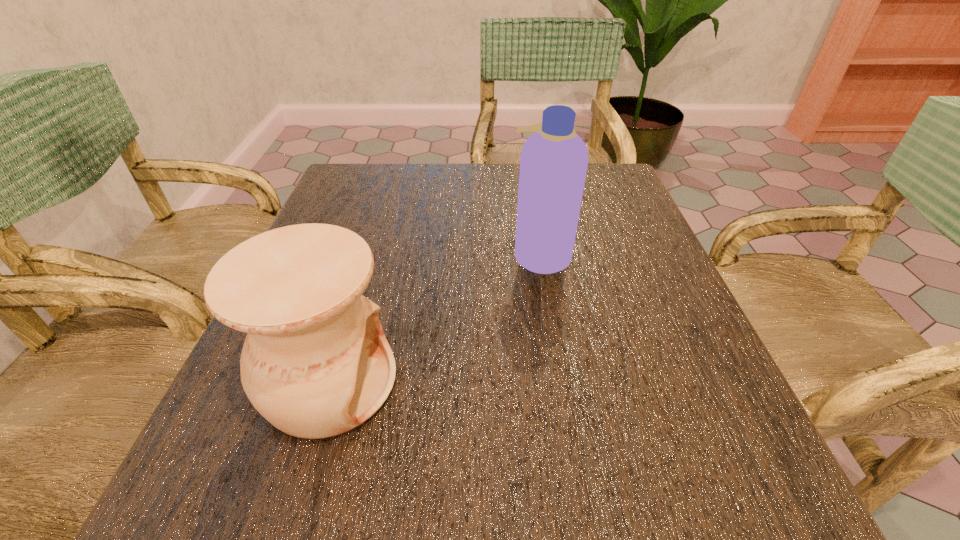
Image resolution: width=960 pixels, height=540 pixels. I want to click on vacant area at the far left corner, so click(336, 181).

This screenshot has width=960, height=540. Identify the location of free point at the near left corner. (227, 461).

Where is `vacant space at the far right corner of the desktop`? vacant space at the far right corner of the desktop is located at coordinates (588, 179).

Where is `vacant space that satisfies the following two spatial constraints: 1. on the front side of the farther object; 2. at the open side of the pottery`? The height and width of the screenshot is (540, 960). vacant space that satisfies the following two spatial constraints: 1. on the front side of the farther object; 2. at the open side of the pottery is located at coordinates (563, 382).

At what (x,y) coordinates should I click in order to perform the action: click on free spot that satisfies the following two spatial constraints: 1. on the front side of the shampoo; 2. at the open side of the left object. Please return your answer as a coordinate pair (x, y). Image resolution: width=960 pixels, height=540 pixels. Looking at the image, I should click on (563, 382).

Identify the location of free space that satisfies the following two spatial constraints: 1. on the front side of the farther object; 2. at the open side of the nearer object. The width and height of the screenshot is (960, 540). (563, 382).

Locate an element on the screen. vacant point that satisfies the following two spatial constraints: 1. on the front side of the farther object; 2. at the open side of the shorter object is located at coordinates (563, 382).